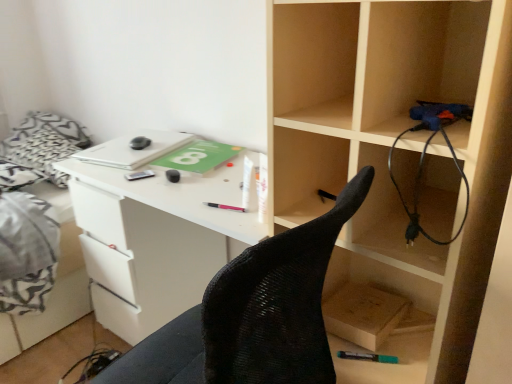
Question: From a real-world perspective, is black rubber wire at right under white fabric bed at left?

Choices:
 (A) yes
 (B) no

Answer: (B)

Question: Is black rubber wire at right thinner than white fabric bed at left?

Choices:
 (A) no
 (B) yes

Answer: (B)

Question: Can you confirm if black rubber wire at right is bigger than white fabric bed at left?

Choices:
 (A) yes
 (B) no

Answer: (B)

Question: Is white fabric bed at left inside black rubber wire at right?

Choices:
 (A) no
 (B) yes

Answer: (A)

Question: Is black rubber wire at right oriented towards white fabric bed at left?

Choices:
 (A) no
 (B) yes

Answer: (A)

Question: From a real-world perspective, relative to wooden box at lower right, is black rubber mouse at center, the third stationery positioned from the right, vertically above or below?

Choices:
 (A) above
 (B) below

Answer: (A)

Question: Considering the positions of point (175, 182) and point (381, 297), is point (175, 182) closer or farther from the camera than point (381, 297)?

Choices:
 (A) closer
 (B) farther

Answer: (B)

Question: Is black rubber mouse at center, which ranks as the fourth stationery in bottom-to-top order, inside or outside of wooden box at lower right?

Choices:
 (A) outside
 (B) inside

Answer: (A)

Question: From their relative heights in the image, would you say black rubber mouse at center, which is counted as the 2th stationery, starting from the left, is taller or shorter than wooden box at lower right?

Choices:
 (A) tall
 (B) short

Answer: (B)

Question: In terms of size, does black rubber mouse at center, which is counted as the 2th stationery, starting from the left, appear bigger or smaller than metallic silver pen at center, marked as the 1th stationery in a back-to-front arrangement?

Choices:
 (A) big
 (B) small

Answer: (A)

Question: In the image, is black rubber mouse at center, the third stationery positioned from the right, on the left side or the right side of metallic silver pen at center, the fourth stationery when ordered from front to back?

Choices:
 (A) left
 (B) right

Answer: (B)

Question: From the image's perspective, is black rubber mouse at center, the third stationery positioned from the right, above or below metallic silver pen at center, which is the 2th stationery in top-to-bottom order?

Choices:
 (A) above
 (B) below

Answer: (A)

Question: From their relative heights in the image, would you say black rubber mouse at center, which ranks as the fourth stationery in bottom-to-top order, is taller or shorter than metallic silver pen at center, the 3th stationery from the bottom?

Choices:
 (A) short
 (B) tall

Answer: (B)

Question: In the image, is white fabric bed at left positioned in front of or behind metallic silver pen at center, marked as the 1th stationery in a back-to-front arrangement?

Choices:
 (A) behind
 (B) front

Answer: (A)

Question: Is white fabric bed at left taller or shorter than metallic silver pen at center, which is the 2th stationery in top-to-bottom order?

Choices:
 (A) short
 (B) tall

Answer: (B)